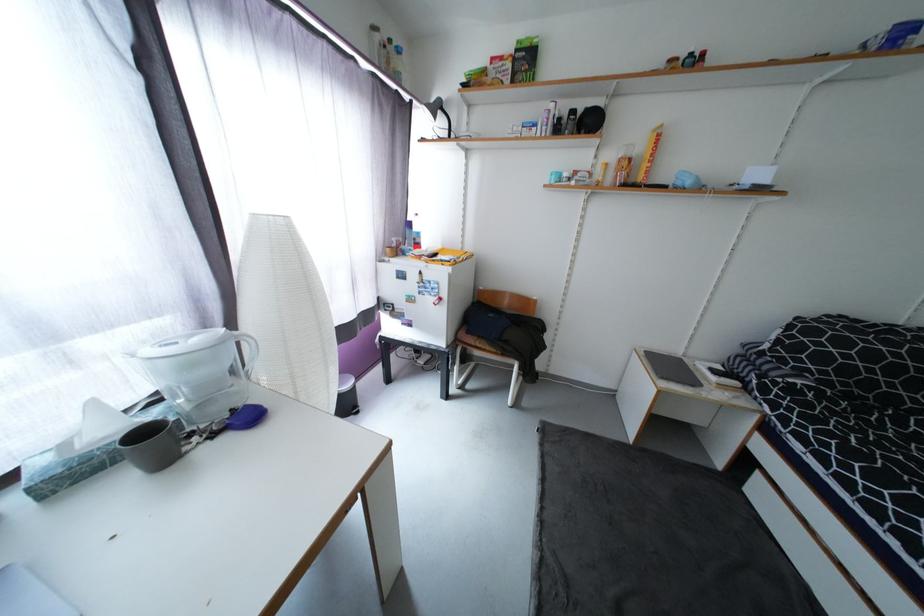
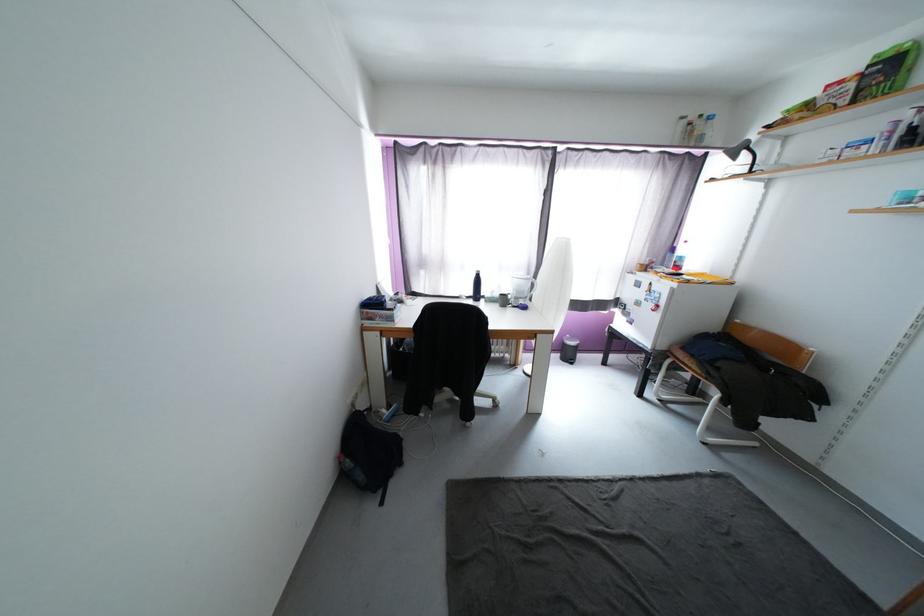
Question: I am providing you with two images of the same scene from different viewpoints. Which of the following objects are not visible in image2?

Choices:
 (A) black backpack
 (B) dark grey mug
 (C) gooseneck lamp head
 (D) white electric kettle

Answer: (B)